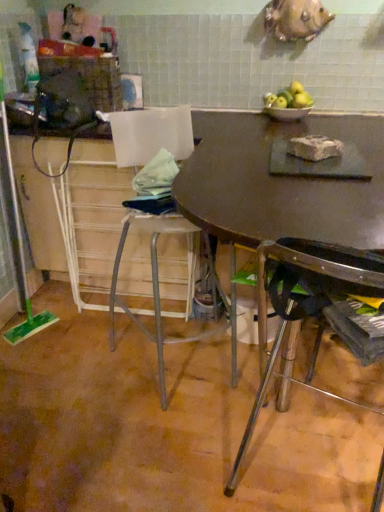
This screenshot has height=512, width=384. Find the location of `free space above matte brown table at center (from a real-world perspective)`. free space above matte brown table at center (from a real-world perspective) is located at coordinates (278, 180).